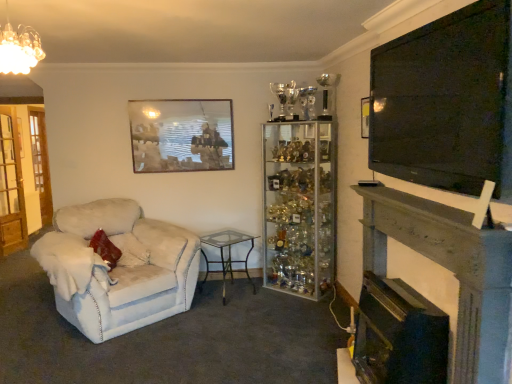
This screenshot has width=512, height=384. Describe the element at coordinates (365, 117) in the screenshot. I see `metallic gold picture frame at upper right, which ranks as the 2th picture frame in back-to-front order` at that location.

What do you see at coordinates (452, 272) in the screenshot? This screenshot has width=512, height=384. I see `wooden mantel at right, the second fireplace viewed from the left` at bounding box center [452, 272].

What is the approximate width of clear glass table at center?

It is 19.38 inches.

Locate an element on the screen. black glossy fireplace at lower right, placed as the second fireplace when sorted from right to left is located at coordinates (399, 335).

Measure the distance between point [353,354] and camera.

They are 2.90 meters apart.

Find the location of a particular element. This screenshot has height=384, width=512. metallic gold picture frame at upper right, the 1th picture frame in the right-to-left sequence is located at coordinates (365, 117).

Is wooden picture frame at upper center, the second picture frame positioned from the right, spatially inside wooden glass door at left, marked as the first glass door in a front-to-back arrangement, or outside of it?

wooden picture frame at upper center, the second picture frame positioned from the right, is outside wooden glass door at left, marked as the first glass door in a front-to-back arrangement.

Starting from the wooden picture frame at upper center, which ranks as the first picture frame in back-to-front order, which glass door is the 1st one behind? Please provide its 2D coordinates.

[(11, 190)]

From the image's perspective, between wooden picture frame at upper center, acting as the first picture frame starting from the left, and wooden glass door at left, which appears as the second glass door when viewed from the left, who is located below?

wooden glass door at left, which appears as the second glass door when viewed from the left.

In the scene shown: Does wooden picture frame at upper center, acting as the first picture frame starting from the left, have a smaller size compared to wooden glass door at left, marked as the first glass door in a front-to-back arrangement?

Yes, wooden picture frame at upper center, acting as the first picture frame starting from the left, is smaller than wooden glass door at left, marked as the first glass door in a front-to-back arrangement.

Which object is positioned more to the right, velvet beige armchair at left or black glossy fireplace at lower right, placed as the second fireplace when sorted from right to left?

black glossy fireplace at lower right, placed as the second fireplace when sorted from right to left.

Identify the location of fireplace directly beneath the velvet beige armchair at left (from a real-world perspective). [399, 335].

Based on the photo, is velvet beige armchair at left aimed at black glossy fireplace at lower right, placed as the second fireplace when sorted from right to left?

Yes, velvet beige armchair at left faces towards black glossy fireplace at lower right, placed as the second fireplace when sorted from right to left.

From their relative heights in the image, would you say velvet beige armchair at left is taller or shorter than black glossy fireplace at lower right, arranged as the first fireplace when viewed from the left?

Considering their sizes, velvet beige armchair at left has more height than black glossy fireplace at lower right, arranged as the first fireplace when viewed from the left.

Is black glossy fireplace at lower right, placed as the second fireplace when sorted from right to left, positioned in front of velvet beige armchair at left?

Yes, black glossy fireplace at lower right, placed as the second fireplace when sorted from right to left, is in front of velvet beige armchair at left.

Find the location of a particular element. This screenshot has width=512, height=384. the 1st fireplace in front of the velvet beige armchair at left, counting from the anchor's position is located at coordinates (399, 335).

Which is closer, (366, 334) or (66, 216)?

Positioned in front is point (366, 334).

From the image's perspective, is black glossy fireplace at lower right, placed as the second fireplace when sorted from right to left, beneath velvet beige armchair at left?

Yes.

Considering the points (46, 223) and (365, 134), which point is behind, point (46, 223) or point (365, 134)?

Point (46, 223)

Is wooden glass door at left, which is counted as the 1th glass door, starting from the left, inside or outside of metallic gold picture frame at upper right, the 1th picture frame in the right-to-left sequence?

wooden glass door at left, which is counted as the 1th glass door, starting from the left, exists outside the volume of metallic gold picture frame at upper right, the 1th picture frame in the right-to-left sequence.

From a real-world perspective, which is physically below, wooden glass door at left, the 1th glass door viewed from the back, or metallic gold picture frame at upper right, which appears as the 2th picture frame when viewed from the left?

wooden glass door at left, the 1th glass door viewed from the back.

Would you say wooden glass door at left, which is counted as the 1th glass door, starting from the left, is to the left or to the right of metallic gold picture frame at upper right, the 1th picture frame in the right-to-left sequence, in the picture?

wooden glass door at left, which is counted as the 1th glass door, starting from the left, is to the left of metallic gold picture frame at upper right, the 1th picture frame in the right-to-left sequence.

Is clear glass trophy cabinet at center turned away from velvet beige armchair at left?

No, velvet beige armchair at left is not at the back of clear glass trophy cabinet at center.

The height and width of the screenshot is (384, 512). I want to click on cabinetry above the velvet beige armchair at left (from the image's perspective), so click(x=298, y=207).

Do you think clear glass trophy cabinet at center is within velvet beige armchair at left, or outside of it?

clear glass trophy cabinet at center is outside velvet beige armchair at left.

Which is nearer, (310, 260) or (63, 244)?

Clearly, point (310, 260) is more distant from the camera than point (63, 244).

Which of these two, wooden glass door at left, marked as the first glass door in a front-to-back arrangement, or clear glass trophy cabinet at center, stands taller?

wooden glass door at left, marked as the first glass door in a front-to-back arrangement.

From the image's perspective, which is below, wooden glass door at left, marked as the first glass door in a front-to-back arrangement, or clear glass trophy cabinet at center?

clear glass trophy cabinet at center, from the image's perspective.

Who is smaller, wooden glass door at left, which appears as the second glass door when viewed from the left, or clear glass trophy cabinet at center?

With smaller size is wooden glass door at left, which appears as the second glass door when viewed from the left.

Between point (21, 242) and point (324, 230), which one is positioned in front?

Positioned in front is point (324, 230).

Does velvet beige armchair at left turn towards clear glass table at center?

No, velvet beige armchair at left is not facing towards clear glass table at center.

Is velvet beige armchair at left positioned far away from clear glass table at center?

They are positioned close to each other.

Does velvet beige armchair at left come behind clear glass table at center?

No, it is in front of clear glass table at center.

At what (x,y) coordinates should I click in order to perform the action: click on chair above the clear glass table at center (from a real-world perspective). Please return your answer as a coordinate pair (x, y). Looking at the image, I should click on (117, 268).

I want to click on glass door that is the 1st object to the left of the wooden picture frame at upper center, acting as the first picture frame starting from the left, starting at the anchor, so click(x=11, y=190).

You are a GUI agent. You are given a task and a screenshot of the screen. Output one action in this format:
    pyautogui.click(x=<x>, y=<y>)
    Task: Click on the 1st fireplace counting from the right of the velvet beige armchair at left
    
    Given the screenshot: What is the action you would take?
    pyautogui.click(x=399, y=335)

Looking at the image, which one is located further to clear glass table at center, black glossy fireplace at lower right, arranged as the first fireplace when viewed from the left, or wooden picture frame at upper center, acting as the first picture frame starting from the left?

black glossy fireplace at lower right, arranged as the first fireplace when viewed from the left, is positioned further to the anchor clear glass table at center.

From the image, which object appears to be nearer to wooden mantel at right, the second fireplace viewed from the left, velvet beige armchair at left or clear glass table at center?

velvet beige armchair at left.

When comparing their distances from black glossy fireplace at lower right, arranged as the first fireplace when viewed from the left, does wooden glass door at left, which is the 2th glass door in front-to-back order, or velvet beige armchair at left seem closer?

velvet beige armchair at left.

Looking at the image, which one is located further to black glossy fireplace at lower right, placed as the second fireplace when sorted from right to left, metallic gold picture frame at upper right, which appears as the 2th picture frame when viewed from the left, or velvet beige armchair at left?

velvet beige armchair at left is further to black glossy fireplace at lower right, placed as the second fireplace when sorted from right to left.

From the image, which object appears to be farther from clear glass trophy cabinet at center, metallic gold picture frame at upper right, which ranks as the 2th picture frame in back-to-front order, or wooden mantel at right, the first fireplace positioned from the right?

wooden mantel at right, the first fireplace positioned from the right, is positioned further to the anchor clear glass trophy cabinet at center.

Based on their spatial positions, is wooden glass door at left, positioned as the 1th glass door in right-to-left order, or clear glass trophy cabinet at center further from black glossy fireplace at lower right, placed as the second fireplace when sorted from right to left?

wooden glass door at left, positioned as the 1th glass door in right-to-left order, is further to black glossy fireplace at lower right, placed as the second fireplace when sorted from right to left.

Estimate the real-world distances between objects in this image. Which object is closer to wooden mantel at right, the first fireplace positioned from the right, black glossy fireplace at lower right, arranged as the first fireplace when viewed from the left, or metallic gold picture frame at upper right, acting as the 1th picture frame starting from the front?

Among the two, black glossy fireplace at lower right, arranged as the first fireplace when viewed from the left, is located nearer to wooden mantel at right, the first fireplace positioned from the right.

Based on the photo, considering their positions, is black glossy fireplace at lower right, arranged as the first fireplace when viewed from the left, positioned further to metallic gold picture frame at upper right, acting as the 1th picture frame starting from the front, than wooden glass door at left, the 1th glass door viewed from the back?

Among the two, wooden glass door at left, the 1th glass door viewed from the back, is located further to metallic gold picture frame at upper right, acting as the 1th picture frame starting from the front.

The width and height of the screenshot is (512, 384). I want to click on cabinetry located between velvet beige armchair at left and wooden mantel at right, the first fireplace positioned from the right, in the left-right direction, so click(298, 207).

The height and width of the screenshot is (384, 512). What are the coordinates of `cabinetry between wooden glass door at left, which appears as the second glass door when viewed from the left, and metallic gold picture frame at upper right, which appears as the 2th picture frame when viewed from the left, from left to right` in the screenshot? It's located at (298, 207).

The height and width of the screenshot is (384, 512). Identify the location of picture frame between black glossy fireplace at lower right, arranged as the first fireplace when viewed from the left, and clear glass trophy cabinet at center in the front-back direction. (365, 117).

You are a GUI agent. You are given a task and a screenshot of the screen. Output one action in this format:
    pyautogui.click(x=<x>, y=<y>)
    Task: Click on the glass door located between wooden glass door at left, which is counted as the 1th glass door, starting from the left, and clear glass table at center in the left-right direction
    
    Given the screenshot: What is the action you would take?
    pyautogui.click(x=11, y=190)